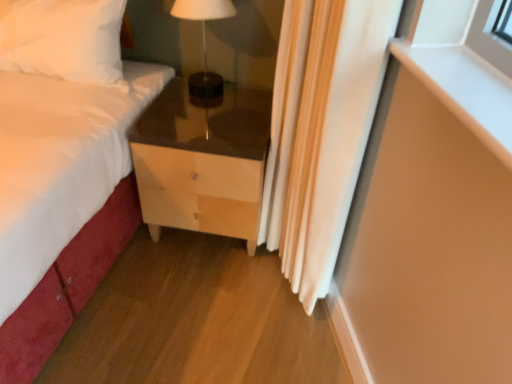
Where is `free spot in front of matte brown table lamp at center`? The image size is (512, 384). free spot in front of matte brown table lamp at center is located at coordinates (195, 112).